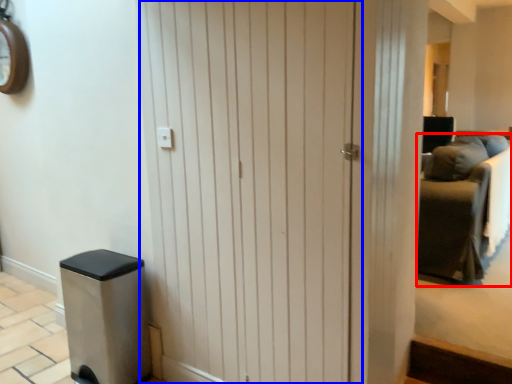
Question: Which object is further to the camera taking this photo, furniture (highlighted by a red box) or barn door (highlighted by a blue box)?

Choices:
 (A) furniture
 (B) barn door

Answer: (A)